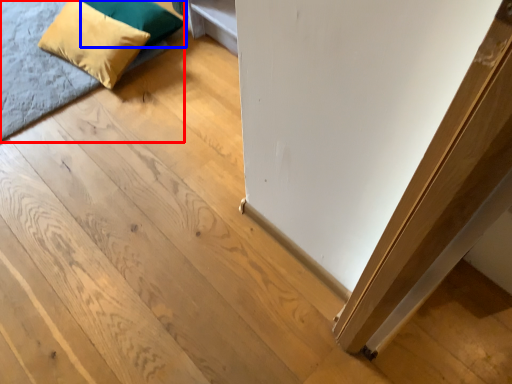
Question: Which of the following is the closest to the observer, bed (highlighted by a red box) or pillow (highlighted by a blue box)?

Choices:
 (A) bed
 (B) pillow

Answer: (A)